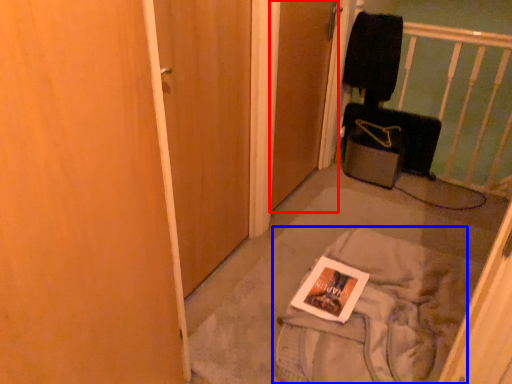
Question: Among these objects, which one is farthest to the camera, door (highlighted by a red box) or material (highlighted by a blue box)?

Choices:
 (A) door
 (B) material

Answer: (A)